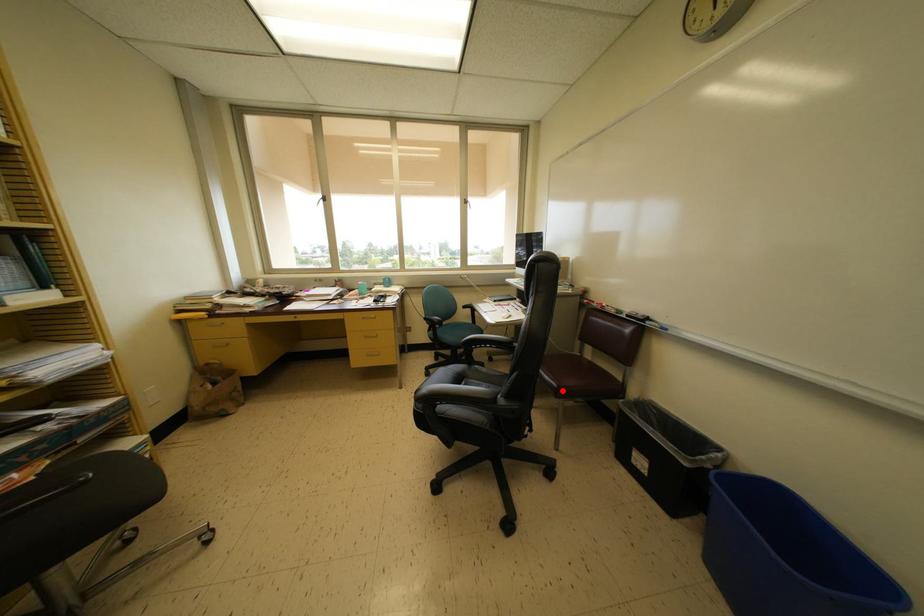
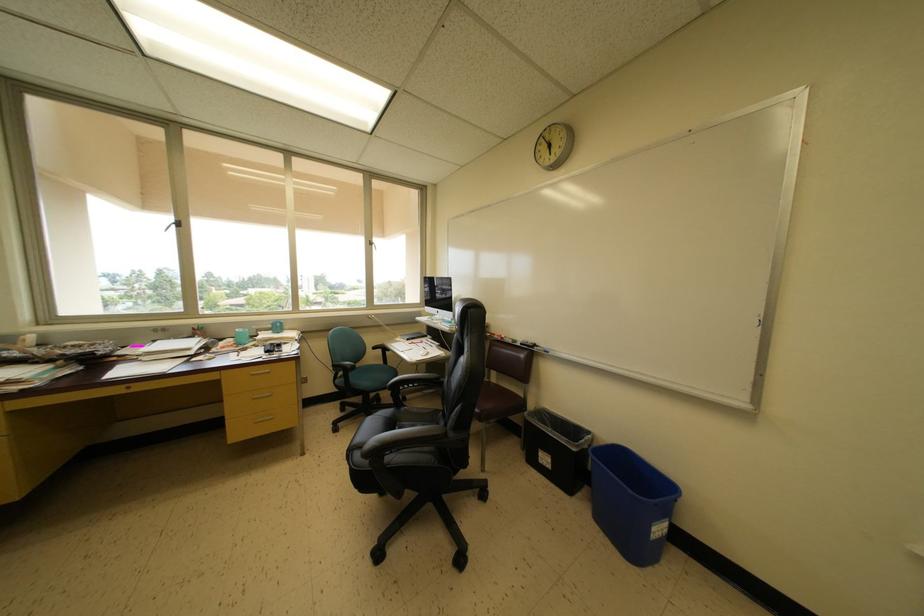
In the second image, find the point that corresponds to the highlighted location in the first image.

(485, 416)